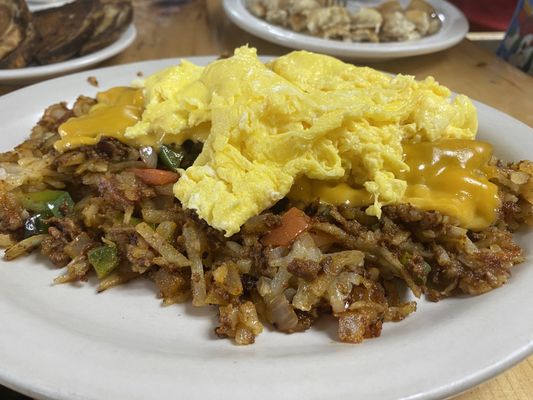
Identify the location of table. This screenshot has height=400, width=533. (193, 35).